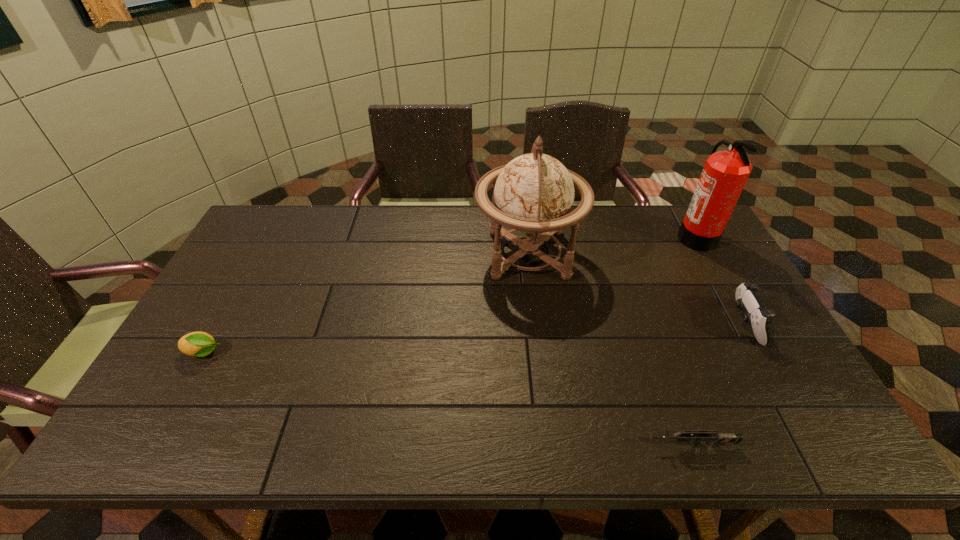
The height and width of the screenshot is (540, 960). What are the coordinates of `vacant space located 0.180m on the front side of the fire extinguisher` in the screenshot? It's located at (625, 237).

The width and height of the screenshot is (960, 540). What are the coordinates of `free region located on the front side of the fire extinguisher` in the screenshot? It's located at (639, 237).

At what (x,y) coordinates should I click in order to perform the action: click on vacant space situated on the front side of the fire extinguisher. Please return your answer as a coordinate pair (x, y). Looking at the image, I should click on (605, 237).

Where is `vacant space situated 0.070m on the front-facing side of the control`? vacant space situated 0.070m on the front-facing side of the control is located at coordinates (708, 324).

The width and height of the screenshot is (960, 540). What are the coordinates of `free location located 0.180m on the front-facing side of the control` in the screenshot? It's located at point(668,324).

I want to click on vacant area situated 0.060m on the front-facing side of the control, so click(711, 324).

Locate an element on the screen. This screenshot has height=540, width=960. vacant area situated 0.090m with leaves positioned above the leftmost object is located at coordinates (258, 353).

Where is `vacant space located 0.280m aimed along the barrel of the nearest object`? vacant space located 0.280m aimed along the barrel of the nearest object is located at coordinates (521, 445).

Where is `vacant space located 0.100m aimed along the barrel of the nearest object`? vacant space located 0.100m aimed along the barrel of the nearest object is located at coordinates click(x=603, y=445).

Locate an element on the screen. The height and width of the screenshot is (540, 960). free space located aimed along the barrel of the nearest object is located at coordinates (585, 445).